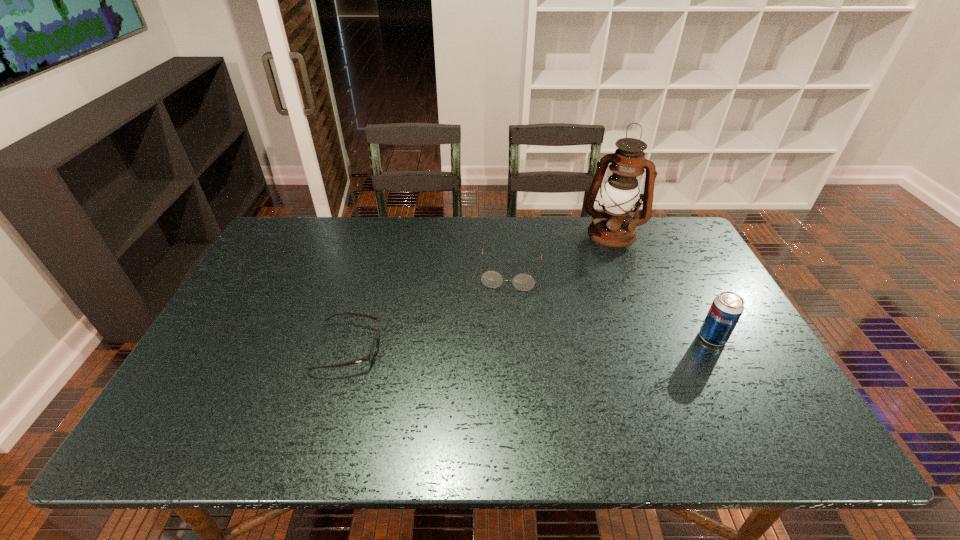
Identify the location of vacant area that lies between the third nearest object and the rightmost object. (612, 305).

This screenshot has width=960, height=540. I want to click on free space between the second shortest object and the rightmost object, so click(x=612, y=305).

Find the location of a particular element. This screenshot has width=960, height=540. vacant region between the tallest object and the third shortest object is located at coordinates (662, 285).

Identify the location of vacant region between the lantern and the sunglasses. The width and height of the screenshot is (960, 540). (480, 290).

Image resolution: width=960 pixels, height=540 pixels. Identify the location of empty space between the third tallest object and the third shortest object. click(612, 305).

Where is `free space between the third tallest object and the beer can`? The image size is (960, 540). free space between the third tallest object and the beer can is located at coordinates (612, 305).

You are a GUI agent. You are given a task and a screenshot of the screen. Output one action in this format:
    pyautogui.click(x=<x>, y=<y>)
    Task: Click on the empty space between the beer can and the leftmost object
    
    Given the screenshot: What is the action you would take?
    pyautogui.click(x=531, y=342)

Where is `object that ranks as the third closest to the sunglasses`? object that ranks as the third closest to the sunglasses is located at coordinates (726, 309).

Identify which object is the nearest to the second object from left to right. Please provide its 2D coordinates. Your answer should be formatted as a tuple, i.e. [(x, y)], where the tuple contains the x and y coordinates of a point satisfying the conditions above.

[(614, 227)]